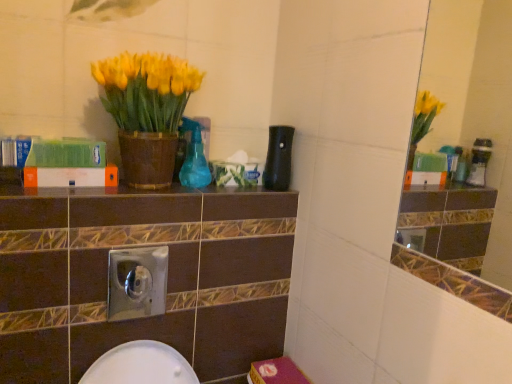
Question: Is yellow matte vase at upper left located within brown glossy ledge at center?

Choices:
 (A) yes
 (B) no

Answer: (B)

Question: From the image's perspective, is brown glossy ledge at center on yellow matte vase at upper left?

Choices:
 (A) yes
 (B) no

Answer: (B)

Question: From the image's perspective, does brown glossy ledge at center appear lower than yellow matte vase at upper left?

Choices:
 (A) no
 (B) yes

Answer: (B)

Question: Is brown glossy ledge at center oriented towards yellow matte vase at upper left?

Choices:
 (A) no
 (B) yes

Answer: (A)

Question: Is brown glossy ledge at center outside of yellow matte vase at upper left?

Choices:
 (A) yes
 (B) no

Answer: (A)

Question: Is the position of brown glossy ledge at center more distant than that of yellow matte vase at upper left?

Choices:
 (A) yes
 (B) no

Answer: (A)

Question: From a real-world perspective, is green matte book at upper left, acting as the 1th book starting from the top, on top of yellow matte vase at upper left?

Choices:
 (A) no
 (B) yes

Answer: (A)

Question: Is green matte book at upper left, acting as the 1th book starting from the top, to the left of yellow matte vase at upper left from the viewer's perspective?

Choices:
 (A) no
 (B) yes

Answer: (B)

Question: Is green matte book at upper left, acting as the 1th book starting from the top, far from yellow matte vase at upper left?

Choices:
 (A) no
 (B) yes

Answer: (A)

Question: Can you confirm if green matte book at upper left, acting as the 1th book starting from the top, is bigger than yellow matte vase at upper left?

Choices:
 (A) no
 (B) yes

Answer: (A)

Question: Does green matte book at upper left, arranged as the 2th book when ordered from the bottom, have a smaller size compared to yellow matte vase at upper left?

Choices:
 (A) no
 (B) yes

Answer: (B)

Question: Does green matte book at upper left, arranged as the 2th book when ordered from the bottom, have a lesser height compared to yellow matte vase at upper left?

Choices:
 (A) no
 (B) yes

Answer: (B)

Question: Is brown glossy ledge at center at the right side of white matte book at center, arranged as the second book when viewed from the top?

Choices:
 (A) yes
 (B) no

Answer: (A)